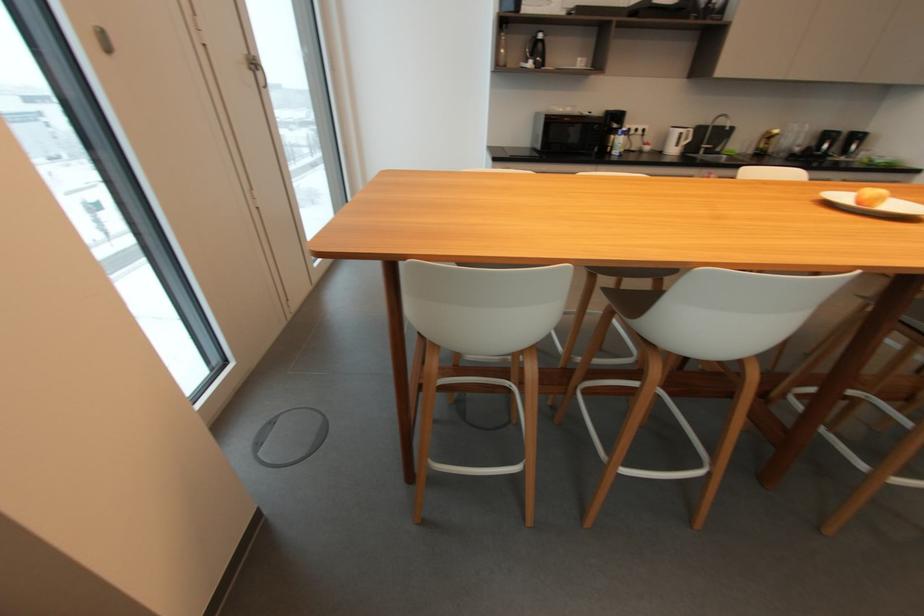
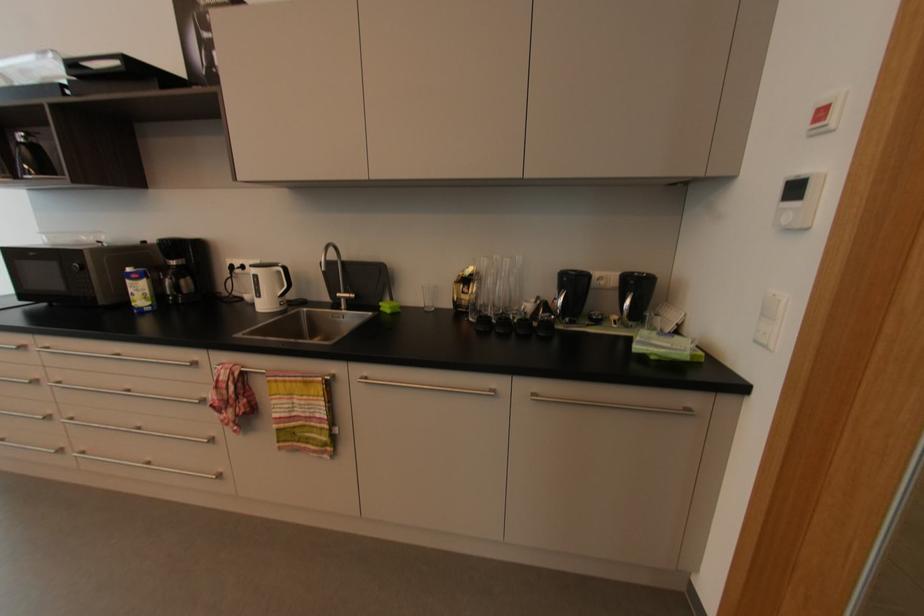
Where in the second image is the point corresponding to (x=710, y=148) from the first image?

(350, 300)